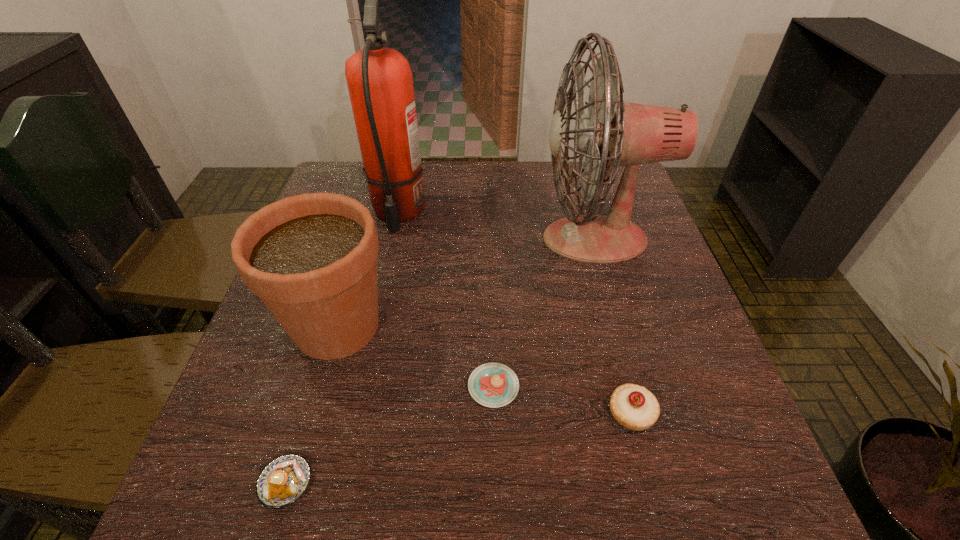
At what (x,y) coordinates should I click in order to perform the action: click on flowerpot situated at the left edge. Please return your answer as a coordinate pair (x, y). This screenshot has height=540, width=960. Looking at the image, I should click on (311, 258).

This screenshot has height=540, width=960. What are the coordinates of `pastry at the left edge` in the screenshot? It's located at (282, 481).

Locate an element on the screen. The image size is (960, 540). fan that is at the right edge is located at coordinates (614, 133).

I want to click on pastry that is at the right edge, so click(x=634, y=407).

The image size is (960, 540). What are the coordinates of `object that is positioned at the far left corner` in the screenshot? It's located at (x=380, y=83).

Image resolution: width=960 pixels, height=540 pixels. In order to click on object that is at the near left corner in this screenshot , I will do `click(282, 481)`.

Find the location of a particular element. This screenshot has width=960, height=540. object at the far right corner is located at coordinates (x=614, y=133).

Where is `free space at the far edge`? Image resolution: width=960 pixels, height=540 pixels. free space at the far edge is located at coordinates (427, 171).

Find the location of `free location at the near edge of the desktop`. free location at the near edge of the desktop is located at coordinates (308, 510).

The image size is (960, 540). In the image, there is a desktop. Find the location of `vacant space at the left edge`. vacant space at the left edge is located at coordinates (261, 327).